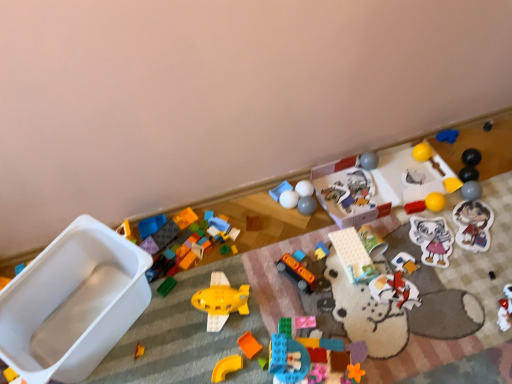
The image size is (512, 384). What are the coordinates of `free space between rubber duck at center, which ranks as the eleventh toy in right-to-left order, and white plastic container at left, which is the 1th toy in left-to-right order` in the screenshot? It's located at (192, 307).